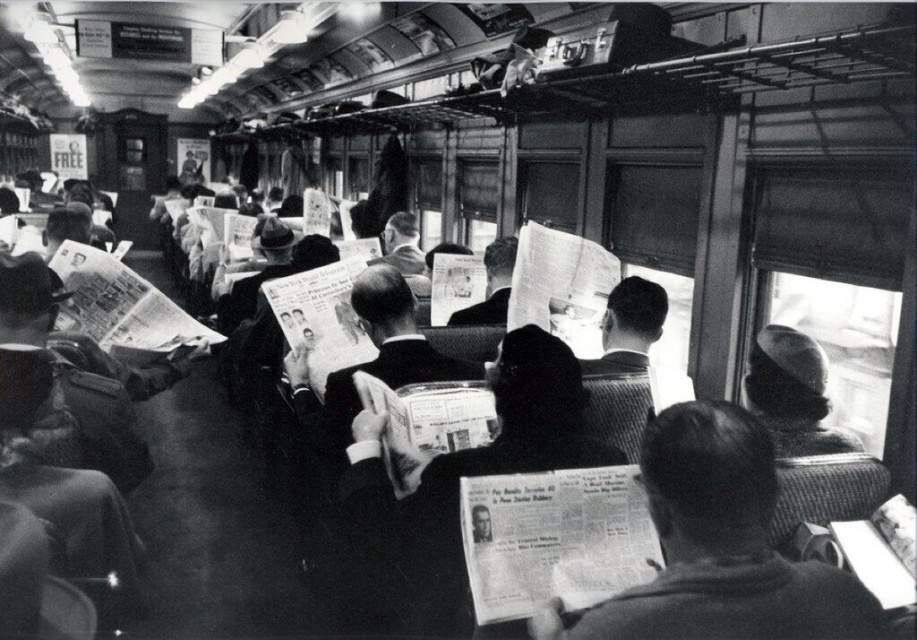
You are a passenger on this vintage train and need to store your belongings in the overhead luggage rack. You have a smooth black coat at center and a smooth gray hat at right. Which item should you place first to ensure both fit in the rack?

The smooth black coat at center is larger than the smooth gray hat at right, so you should place the smooth black coat at center first to make sure both items fit in the rack.

You are a passenger on this vintage train car and want to place a small backpack between the two points, point (699, 524) and point (777, 449). Can you determine if the backpack will fit between them?

Point (699, 524) is in front of point (777, 449), so the backpack can be placed between them as they are positioned in a way that allows space in front and behind.

From the picture: You are a delivery robot with a width of 0.8 meters. You need to move from the smooth black coat at center to the smooth gray hat at right. Is there enough space for you to pass through the gap between them?

The distance between the smooth black coat at center and the smooth gray hat at right is 1.06 meters. Since your width is 0.8 meters, you can pass through the gap as the distance is wider than your width.